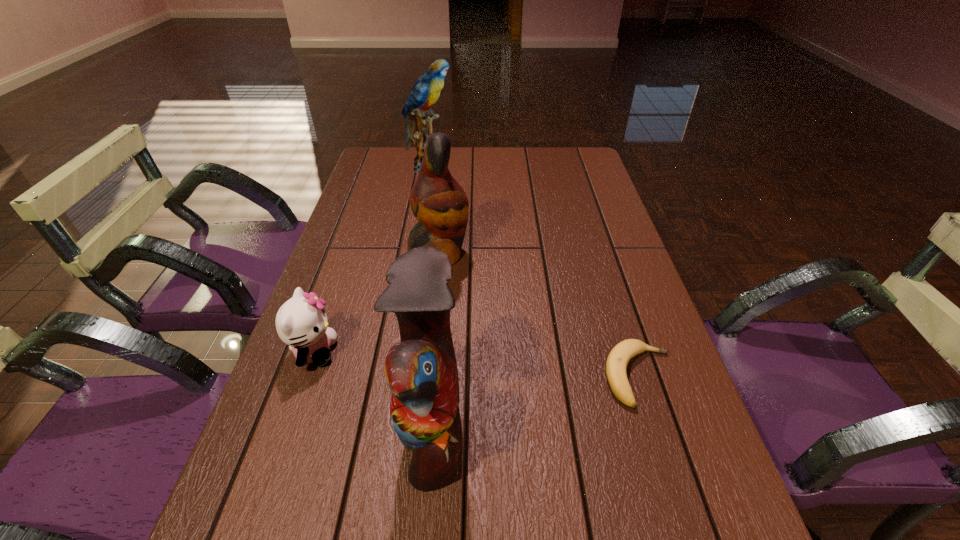
Find the location of a particular element. free space that satisfies the following two spatial constraints: 1. on the front-facing side of the rightmost object; 2. on the left side of the kitten is located at coordinates (305, 376).

This screenshot has width=960, height=540. I want to click on free space in the image that satisfies the following two spatial constraints: 1. on the front-facing side of the second shortest object; 2. on the back side of the shortest object, so click(x=305, y=376).

Where is `free spot that satisfies the following two spatial constraints: 1. on the front-facing side of the rightmost object; 2. on the left side of the leftmost object`? The image size is (960, 540). free spot that satisfies the following two spatial constraints: 1. on the front-facing side of the rightmost object; 2. on the left side of the leftmost object is located at coordinates (305, 376).